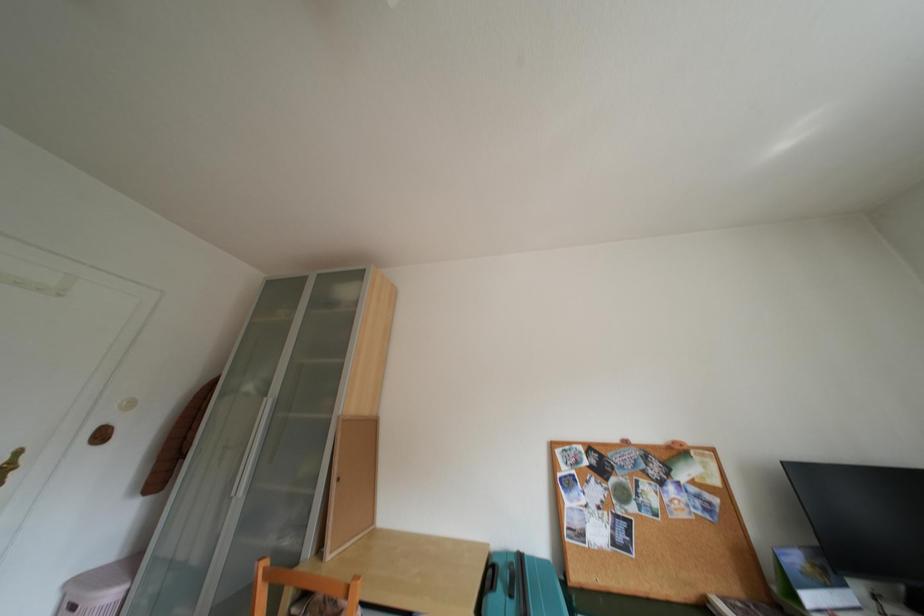
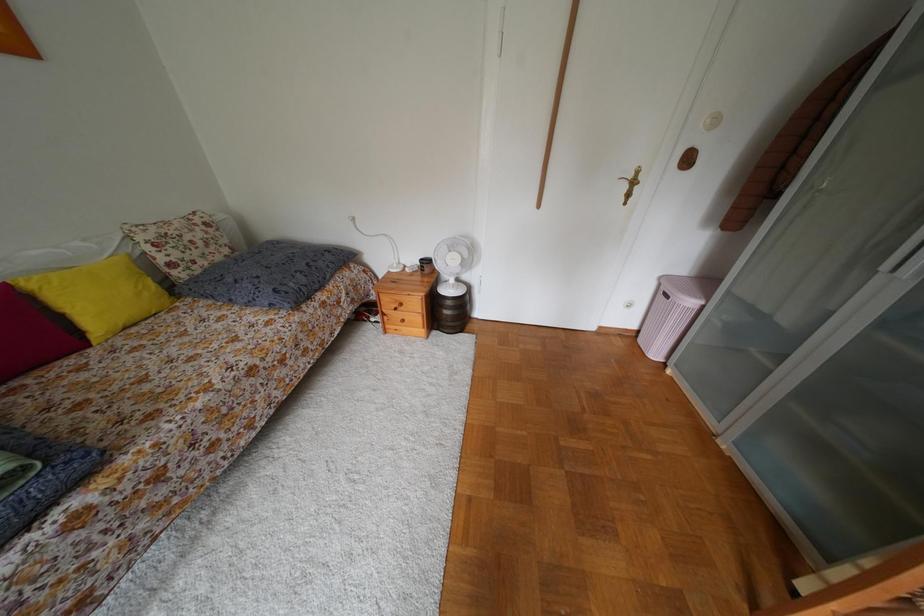
The first image is from the beginning of the video and the second image is from the end. How did the camera likely rotate when shooting the video?

The rotation direction of the camera is left-down.